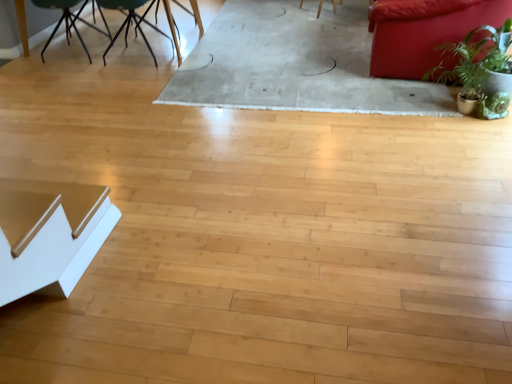
Locate an element on the screen. This screenshot has width=512, height=384. free area in between matte red couch at upper right and white glossy table at lower left is located at coordinates (261, 164).